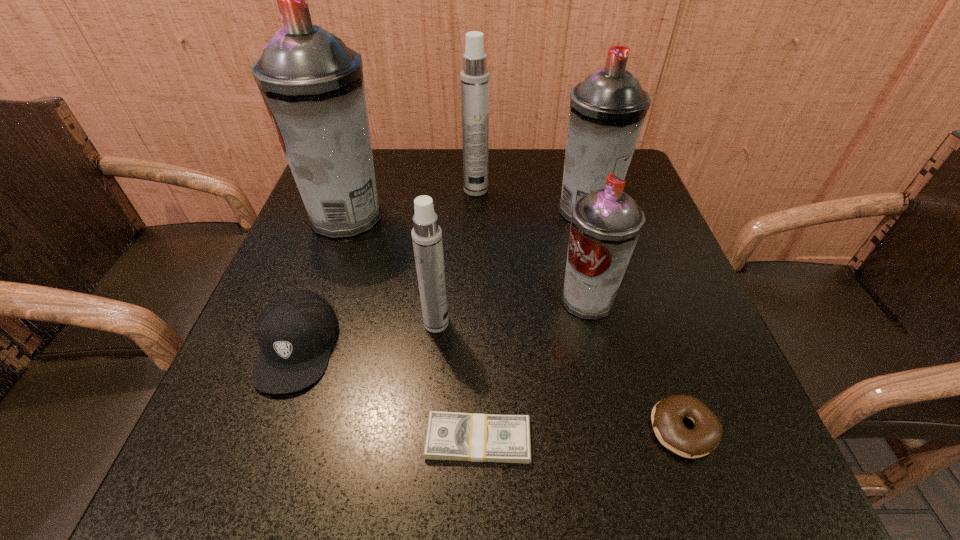
Identify the location of doughnut that is at the near edge. Image resolution: width=960 pixels, height=540 pixels. (667, 415).

Where is `dollar positioned at the near edge`? Image resolution: width=960 pixels, height=540 pixels. dollar positioned at the near edge is located at coordinates (472, 437).

This screenshot has height=540, width=960. In order to click on aerosol can located in the left edge section of the desktop in this screenshot , I will do `click(312, 84)`.

The width and height of the screenshot is (960, 540). Find the location of `cap present at the left edge`. cap present at the left edge is located at coordinates (295, 331).

Image resolution: width=960 pixels, height=540 pixels. In order to click on doughnut that is at the right edge in this screenshot , I will do coord(667,415).

Identify the location of object that is at the far left corner. (312, 84).

Find the location of a particular element. object that is at the far right corner is located at coordinates (607, 110).

Image resolution: width=960 pixels, height=540 pixels. I want to click on object located in the near right corner section of the desktop, so click(x=667, y=415).

In the image, there is a desktop. In order to click on vacant space at the far edge in this screenshot , I will do `click(439, 180)`.

Locate an element on the screen. free space at the near edge of the desktop is located at coordinates (390, 463).